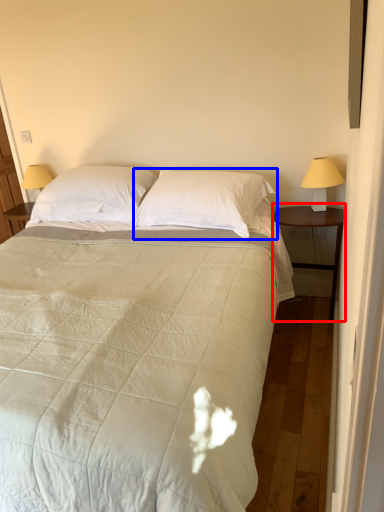
Question: Which object is further to the camera taking this photo, nightstand (highlighted by a red box) or pillow (highlighted by a blue box)?

Choices:
 (A) nightstand
 (B) pillow

Answer: (A)